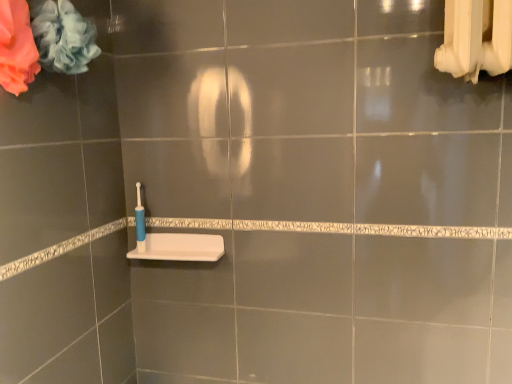
In order to face white matte sink at lower center, should I rotate leftwards or rightwards?

A: Rotate left and turn 10.777 degrees.

Where is `soft pink fabric at upper left, placed as the second flower when sorted from right to left`? Image resolution: width=512 pixels, height=384 pixels. soft pink fabric at upper left, placed as the second flower when sorted from right to left is located at coordinates (17, 47).

Measure the distance from soft pink fabric at upper left, arranged as the 1th flower when viewed from the left, to white matte sink at lower center.

soft pink fabric at upper left, arranged as the 1th flower when viewed from the left, and white matte sink at lower center are 25.58 inches apart from each other.

Based on their positions, is soft pink fabric at upper left, placed as the second flower when sorted from right to left, located to the left or right of white matte sink at lower center?

Based on their positions, soft pink fabric at upper left, placed as the second flower when sorted from right to left, is located to the left of white matte sink at lower center.

From a real-world perspective, who is located lower, soft pink fabric at upper left, arranged as the 1th flower when viewed from the left, or white matte sink at lower center?

In real-world perspective, white matte sink at lower center is lower.

Is soft pink fabric at upper left, placed as the second flower when sorted from right to left, with white matte sink at lower center?

No, soft pink fabric at upper left, placed as the second flower when sorted from right to left, is not beside white matte sink at lower center.

This screenshot has width=512, height=384. I want to click on flower below the soft blue fabric at upper left, which ranks as the 2th flower in left-to-right order (from a real-world perspective), so click(x=17, y=47).

Is soft pink fabric at upper left, arranged as the 1th flower when viewed from the left, smaller than soft blue fabric at upper left, the first flower positioned from the right?

Yes, soft pink fabric at upper left, arranged as the 1th flower when viewed from the left, is smaller than soft blue fabric at upper left, the first flower positioned from the right.

What's the angular difference between soft pink fabric at upper left, arranged as the 1th flower when viewed from the left, and soft blue fabric at upper left, the first flower positioned from the right,'s facing directions?

They differ by 0.000779 degrees in their facing directions.

Which of these two, blue plastic toothbrush at lower left or soft blue fabric at upper left, the first flower positioned from the right, is wider?

soft blue fabric at upper left, the first flower positioned from the right, is wider.

Between blue plastic toothbrush at lower left and soft blue fabric at upper left, the first flower positioned from the right, which one appears on the right side from the viewer's perspective?

blue plastic toothbrush at lower left is more to the right.

Would you say blue plastic toothbrush at lower left contains soft blue fabric at upper left, which ranks as the 2th flower in left-to-right order?

No, soft blue fabric at upper left, which ranks as the 2th flower in left-to-right order, is not a part of blue plastic toothbrush at lower left.

From a real-world perspective, relative to soft blue fabric at upper left, the first flower positioned from the right, is blue plastic toothbrush at lower left vertically above or below?

From a real-world perspective, blue plastic toothbrush at lower left is physically below soft blue fabric at upper left, the first flower positioned from the right.

From a real-world perspective, between white matte sink at lower center and blue plastic toothbrush at lower left, who is vertically lower?

white matte sink at lower center is physically lower.

In the scene shown: Can you see white matte sink at lower center touching blue plastic toothbrush at lower left?

No, white matte sink at lower center is not making contact with blue plastic toothbrush at lower left.

Looking at the image, does white matte sink at lower center seem bigger or smaller compared to blue plastic toothbrush at lower left?

Clearly, white matte sink at lower center is larger in size than blue plastic toothbrush at lower left.

Where is `toothbrush above the white matte sink at lower center (from the image's perspective)`? This screenshot has width=512, height=384. toothbrush above the white matte sink at lower center (from the image's perspective) is located at coordinates (140, 221).

From a real-world perspective, is soft blue fabric at upper left, the first flower positioned from the right, physically below blue plastic toothbrush at lower left?

No, from a real-world perspective, soft blue fabric at upper left, the first flower positioned from the right, is not below blue plastic toothbrush at lower left.

Consider the image. From the image's perspective, is soft blue fabric at upper left, the first flower positioned from the right, located beneath blue plastic toothbrush at lower left?

Actually, soft blue fabric at upper left, the first flower positioned from the right, appears above blue plastic toothbrush at lower left in the image.

In the image, is soft blue fabric at upper left, which ranks as the 2th flower in left-to-right order, positioned in front of or behind blue plastic toothbrush at lower left?

Visually, soft blue fabric at upper left, which ranks as the 2th flower in left-to-right order, is located in front of blue plastic toothbrush at lower left.

Considering the relative sizes of soft blue fabric at upper left, which ranks as the 2th flower in left-to-right order, and blue plastic toothbrush at lower left in the image provided, is soft blue fabric at upper left, which ranks as the 2th flower in left-to-right order, thinner than blue plastic toothbrush at lower left?

Incorrect, the width of soft blue fabric at upper left, which ranks as the 2th flower in left-to-right order, is not less than that of blue plastic toothbrush at lower left.

In terms of size, does soft pink fabric at upper left, placed as the second flower when sorted from right to left, appear bigger or smaller than blue plastic toothbrush at lower left?

Considering their sizes, soft pink fabric at upper left, placed as the second flower when sorted from right to left, takes up more space than blue plastic toothbrush at lower left.

Considering the positions of objects soft pink fabric at upper left, placed as the second flower when sorted from right to left, and blue plastic toothbrush at lower left in the image provided, who is behind, soft pink fabric at upper left, placed as the second flower when sorted from right to left, or blue plastic toothbrush at lower left?

blue plastic toothbrush at lower left.

Is soft pink fabric at upper left, arranged as the 1th flower when viewed from the left, looking in the opposite direction of blue plastic toothbrush at lower left?

No, soft pink fabric at upper left, arranged as the 1th flower when viewed from the left, is not facing the opposite direction of blue plastic toothbrush at lower left.

Locate an element on the screen. This screenshot has width=512, height=384. the 2nd flower in front of the blue plastic toothbrush at lower left, starting your count from the anchor is located at coordinates (17, 47).

Is blue plastic toothbrush at lower left positioned with its back to soft pink fabric at upper left, arranged as the 1th flower when viewed from the left?

blue plastic toothbrush at lower left does not have its back to soft pink fabric at upper left, arranged as the 1th flower when viewed from the left.

Is the position of blue plastic toothbrush at lower left less distant than that of soft pink fabric at upper left, placed as the second flower when sorted from right to left?

No.

Is blue plastic toothbrush at lower left far away from soft pink fabric at upper left, arranged as the 1th flower when viewed from the left?

That's not correct — blue plastic toothbrush at lower left is a little close to soft pink fabric at upper left, arranged as the 1th flower when viewed from the left.

From the image's perspective, which flower is the 1st one above the white matte sink at lower center? Please provide its 2D coordinates.

[(17, 47)]

Identify the location of flower located on the left of soft blue fabric at upper left, which ranks as the 2th flower in left-to-right order. This screenshot has height=384, width=512. (17, 47).

Based on their spatial positions, is soft blue fabric at upper left, the first flower positioned from the right, or white matte sink at lower center closer to soft pink fabric at upper left, placed as the second flower when sorted from right to left?

soft blue fabric at upper left, the first flower positioned from the right, is positioned closer to the anchor soft pink fabric at upper left, placed as the second flower when sorted from right to left.

Looking at the image, which one is located further to soft blue fabric at upper left, which ranks as the 2th flower in left-to-right order, blue plastic toothbrush at lower left or white matte sink at lower center?

white matte sink at lower center lies further to soft blue fabric at upper left, which ranks as the 2th flower in left-to-right order, than the other object.

Considering their positions, is white matte sink at lower center positioned closer to soft blue fabric at upper left, which ranks as the 2th flower in left-to-right order, than blue plastic toothbrush at lower left?

Based on the image, blue plastic toothbrush at lower left appears to be nearer to soft blue fabric at upper left, which ranks as the 2th flower in left-to-right order.

Estimate the real-world distances between objects in this image. Which object is further from white matte sink at lower center, soft blue fabric at upper left, which ranks as the 2th flower in left-to-right order, or blue plastic toothbrush at lower left?

Based on the image, soft blue fabric at upper left, which ranks as the 2th flower in left-to-right order, appears to be further to white matte sink at lower center.

In the scene shown: Looking at the image, which one is located further to white matte sink at lower center, soft pink fabric at upper left, placed as the second flower when sorted from right to left, or blue plastic toothbrush at lower left?

soft pink fabric at upper left, placed as the second flower when sorted from right to left, lies further to white matte sink at lower center than the other object.

Based on their spatial positions, is blue plastic toothbrush at lower left or soft pink fabric at upper left, placed as the second flower when sorted from right to left, closer to soft blue fabric at upper left, which ranks as the 2th flower in left-to-right order?

soft pink fabric at upper left, placed as the second flower when sorted from right to left, lies closer to soft blue fabric at upper left, which ranks as the 2th flower in left-to-right order, than the other object.

Which object lies nearer to the anchor point soft pink fabric at upper left, arranged as the 1th flower when viewed from the left, blue plastic toothbrush at lower left or soft blue fabric at upper left, which ranks as the 2th flower in left-to-right order?

Among the two, soft blue fabric at upper left, which ranks as the 2th flower in left-to-right order, is located nearer to soft pink fabric at upper left, arranged as the 1th flower when viewed from the left.

Estimate the real-world distances between objects in this image. Which object is closer to white matte sink at lower center, blue plastic toothbrush at lower left or soft blue fabric at upper left, which ranks as the 2th flower in left-to-right order?

blue plastic toothbrush at lower left lies closer to white matte sink at lower center than the other object.

Where is `flower between soft blue fabric at upper left, which ranks as the 2th flower in left-to-right order, and white matte sink at lower center vertically`? flower between soft blue fabric at upper left, which ranks as the 2th flower in left-to-right order, and white matte sink at lower center vertically is located at coordinates (17, 47).

At what (x,y) coordinates should I click in order to perform the action: click on toothbrush between soft blue fabric at upper left, the first flower positioned from the right, and white matte sink at lower center in the up-down direction. Please return your answer as a coordinate pair (x, y). The image size is (512, 384). Looking at the image, I should click on (140, 221).

Find the location of a particular element. sink between soft pink fabric at upper left, arranged as the 1th flower when viewed from the left, and blue plastic toothbrush at lower left, along the z-axis is located at coordinates (181, 247).

You are a GUI agent. You are given a task and a screenshot of the screen. Output one action in this format:
    pyautogui.click(x=<x>, y=<y>)
    Task: Click on the flower between soft pink fabric at upper left, placed as the second flower when sorted from right to left, and blue plastic toothbrush at lower left from front to back
    
    Given the screenshot: What is the action you would take?
    pyautogui.click(x=63, y=36)